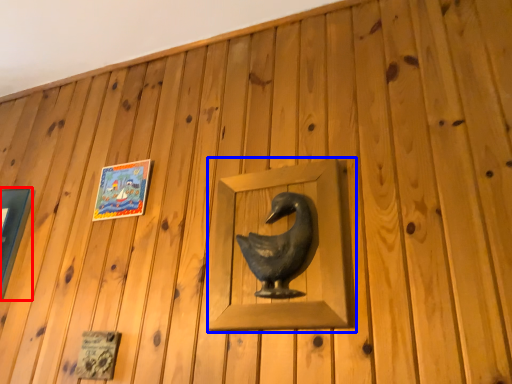
Question: Which object is further to the camera taking this photo, picture frame (highlighted by a red box) or sculpture (highlighted by a blue box)?

Choices:
 (A) picture frame
 (B) sculpture

Answer: (A)